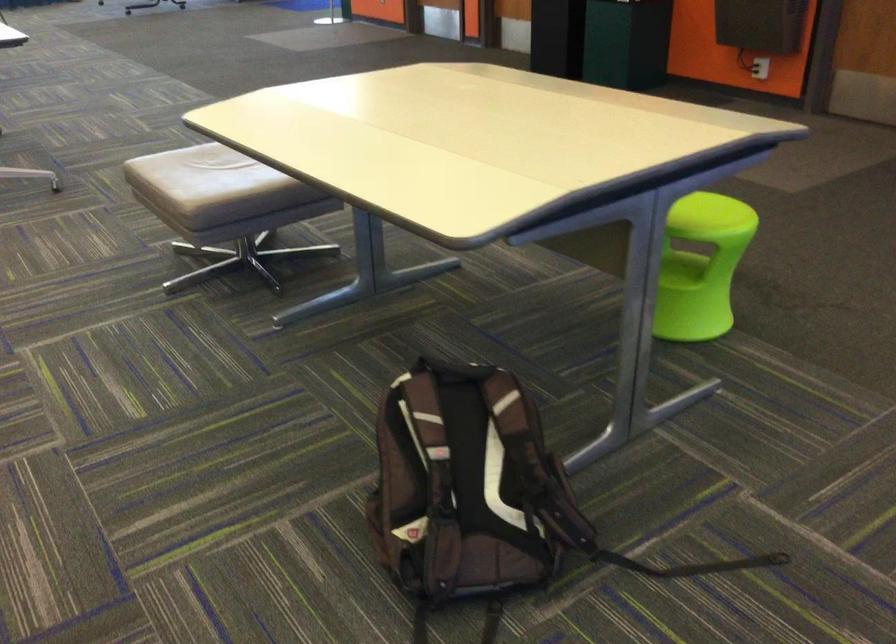
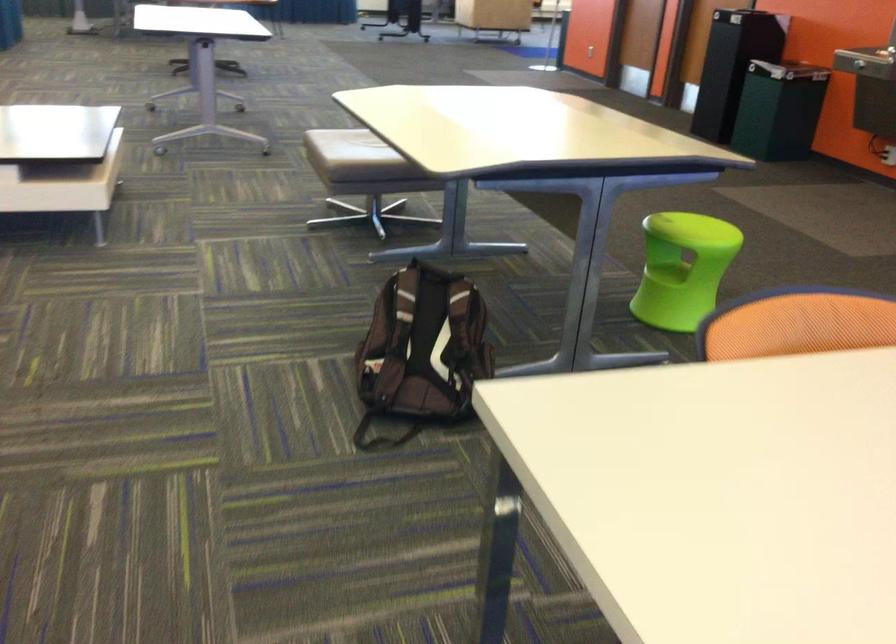
In a continuous first-person perspective shot, in which direction is the camera moving?

The cameraman moved toward right, backward.